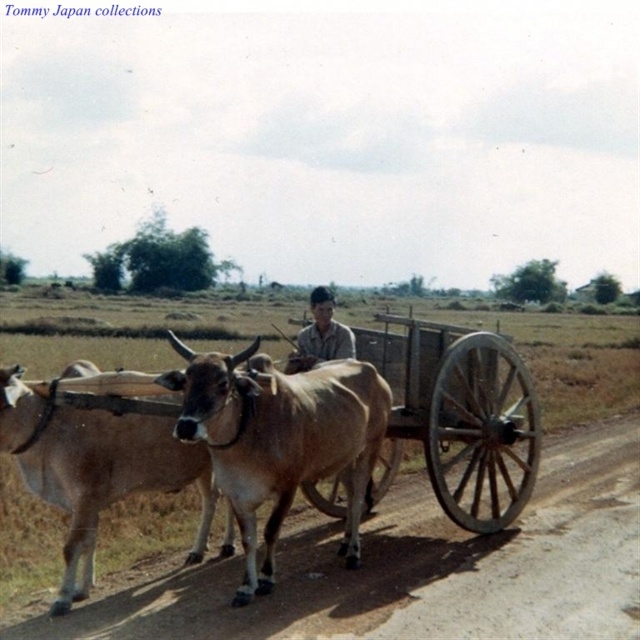
Question: Does light brown glossy bull at center appear on the left side of light brown cow at center?

Choices:
 (A) no
 (B) yes

Answer: (A)

Question: Does light brown glossy bull at center have a larger size compared to light brown shirt at center?

Choices:
 (A) yes
 (B) no

Answer: (B)

Question: Is wooden wagon at center bigger than light brown cow at center?

Choices:
 (A) no
 (B) yes

Answer: (B)

Question: Which object appears closest to the camera in this image?

Choices:
 (A) light brown glossy bull at center
 (B) wooden wagon at center
 (C) light brown cow at center

Answer: (C)

Question: Based on their relative distances, which object is farther from the light brown shirt at center?

Choices:
 (A) light brown cow at center
 (B) wooden wagon at center

Answer: (A)

Question: Which object is the closest to the wooden wagon at center?

Choices:
 (A) light brown glossy bull at center
 (B) light brown shirt at center
 (C) light brown cow at center

Answer: (B)